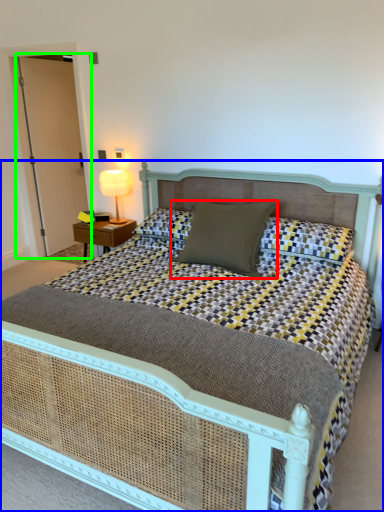
Question: Which object is the closest to the pillow (highlighted by a red box)? Choose among these: bed (highlighted by a blue box) or glass door (highlighted by a green box).

Choices:
 (A) bed
 (B) glass door

Answer: (A)